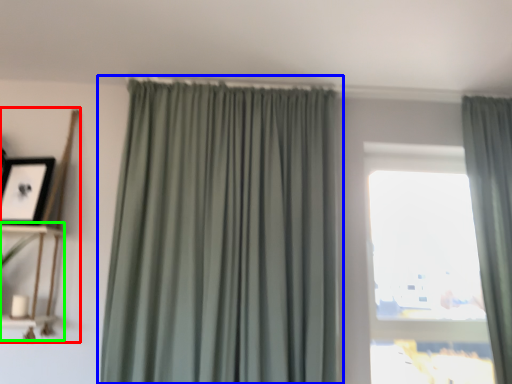
Question: Based on their relative distances, which object is nearer to shelf (highlighted by a red box)? Choose from curtain (highlighted by a blue box) and shelf (highlighted by a green box).

Choices:
 (A) curtain
 (B) shelf

Answer: (B)